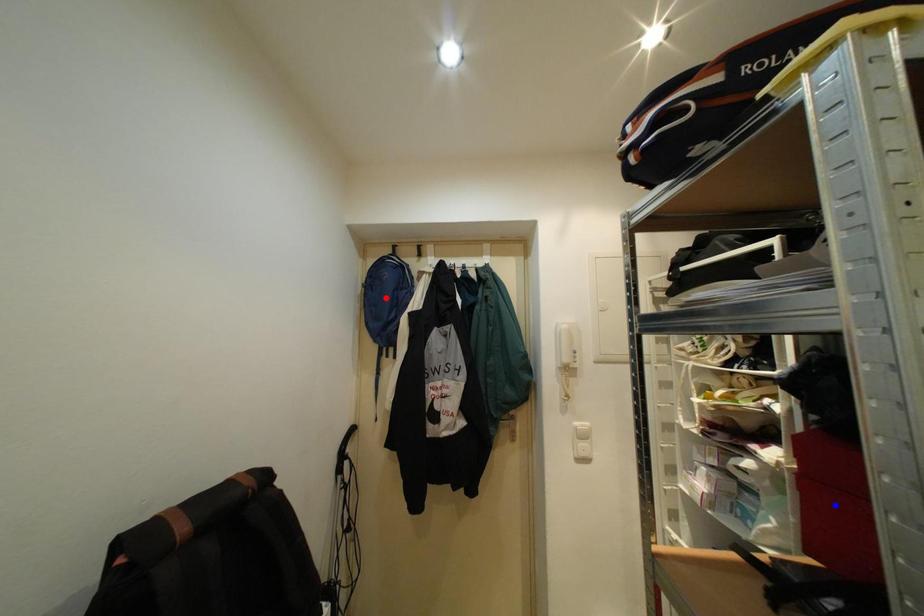
Question: Which of the two points in the image is closer to the camera?

Choices:
 (A) Blue point is closer.
 (B) Red point is closer.

Answer: (A)